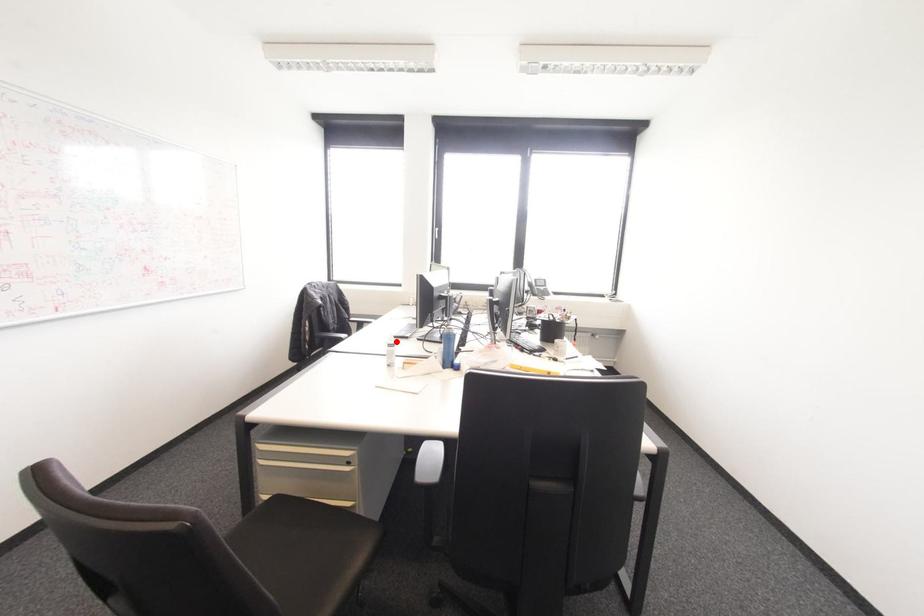
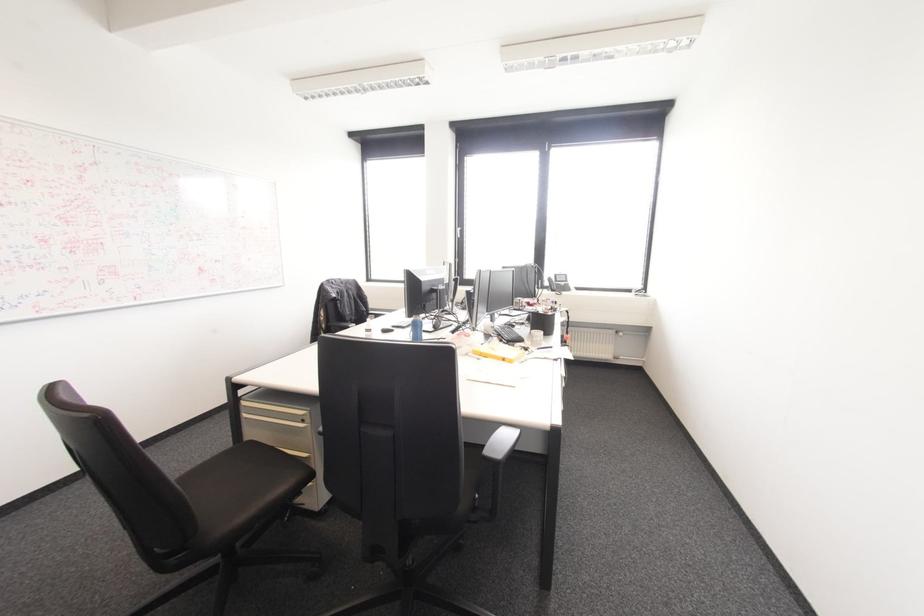
Locate, in the second image, the point that corresponds to the highlighted location in the first image.

(392, 331)